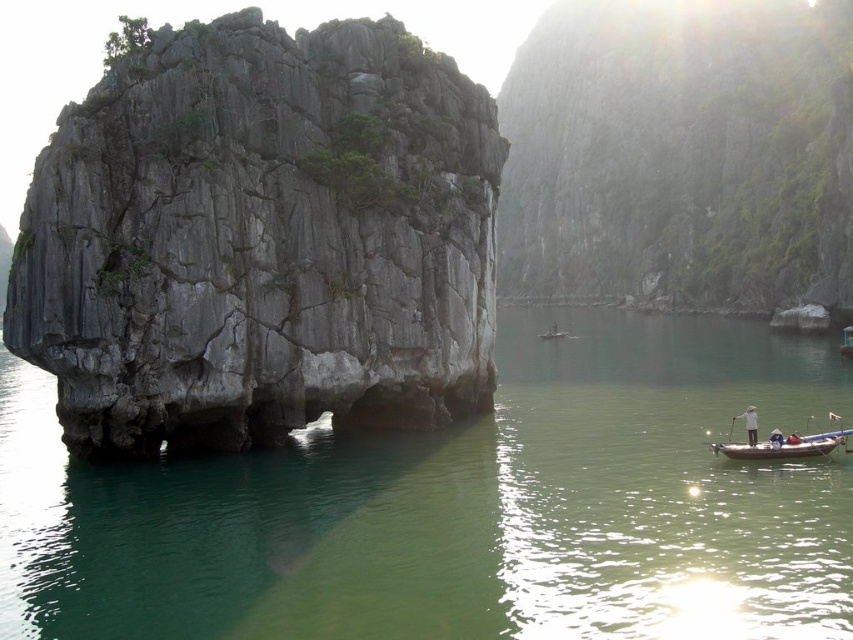
Question: Can you confirm if gray/rough rock at center is wider than wooden boat at lower right?

Choices:
 (A) no
 (B) yes

Answer: (B)

Question: Estimate the real-world distances between objects in this image. Which object is closer to the wooden canoe at lower right?

Choices:
 (A) wooden boat at lower right
 (B) green water at center

Answer: (A)

Question: Which point is farther from the camera taking this photo?

Choices:
 (A) (793, 433)
 (B) (753, 412)
 (C) (804, 454)
 (D) (341, 28)

Answer: (D)

Question: Can you confirm if green water at center is positioned to the left of gray/rough rock at center?

Choices:
 (A) no
 (B) yes

Answer: (A)

Question: Which point is farther to the camera?

Choices:
 (A) gray rock cliff at center
 (B) gray/rough rock at center

Answer: (A)

Question: Does green water at center have a larger size compared to gray rock cliff at center?

Choices:
 (A) yes
 (B) no

Answer: (B)